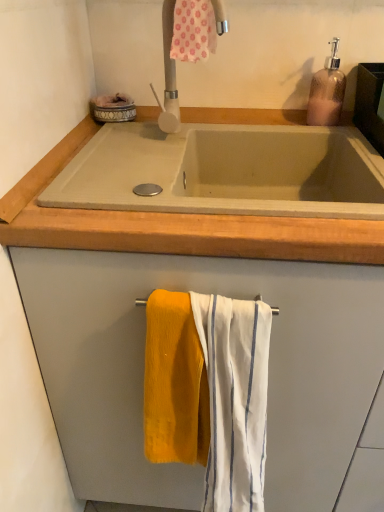
Question: Which direction should I rotate to face white striped fabric at center, the 3th bath towel positioned from the top, — up or down?

Choices:
 (A) up
 (B) down

Answer: (B)

Question: Is translucent brown soap dispenser at upper right facing towards pink floral fabric at upper center, marked as the 3th bath towel in a bottom-to-top arrangement?

Choices:
 (A) no
 (B) yes

Answer: (A)

Question: Is translucent brown soap dispenser at upper right wider than pink floral fabric at upper center, marked as the 3th bath towel in a bottom-to-top arrangement?

Choices:
 (A) no
 (B) yes

Answer: (B)

Question: Considering the relative positions of translucent brown soap dispenser at upper right and pink floral fabric at upper center, marked as the 3th bath towel in a bottom-to-top arrangement, in the image provided, is translucent brown soap dispenser at upper right behind pink floral fabric at upper center, marked as the 3th bath towel in a bottom-to-top arrangement,?

Choices:
 (A) yes
 (B) no

Answer: (A)

Question: Is translucent brown soap dispenser at upper right closer to camera compared to pink floral fabric at upper center, which ranks as the first bath towel in top-to-bottom order?

Choices:
 (A) no
 (B) yes

Answer: (A)

Question: Is there a large distance between translucent brown soap dispenser at upper right and pink floral fabric at upper center, marked as the 3th bath towel in a bottom-to-top arrangement?

Choices:
 (A) no
 (B) yes

Answer: (A)

Question: From a real-world perspective, is translucent brown soap dispenser at upper right on pink floral fabric at upper center, which ranks as the first bath towel in top-to-bottom order?

Choices:
 (A) no
 (B) yes

Answer: (A)

Question: Can you confirm if white matte tap at upper center is positioned to the right of concrete sink at center?

Choices:
 (A) yes
 (B) no

Answer: (B)

Question: Does white matte tap at upper center have a greater width compared to concrete sink at center?

Choices:
 (A) no
 (B) yes

Answer: (A)

Question: Is white matte tap at upper center shorter than concrete sink at center?

Choices:
 (A) no
 (B) yes

Answer: (A)

Question: From a real-world perspective, is white matte tap at upper center under concrete sink at center?

Choices:
 (A) yes
 (B) no

Answer: (B)

Question: From a real-world perspective, is white matte tap at upper center located higher than concrete sink at center?

Choices:
 (A) yes
 (B) no

Answer: (A)

Question: Can you confirm if white matte tap at upper center is bigger than concrete sink at center?

Choices:
 (A) yes
 (B) no

Answer: (B)

Question: Is pink floral fabric at upper center, marked as the 3th bath towel in a bottom-to-top arrangement, positioned in front of concrete sink at center?

Choices:
 (A) no
 (B) yes

Answer: (A)